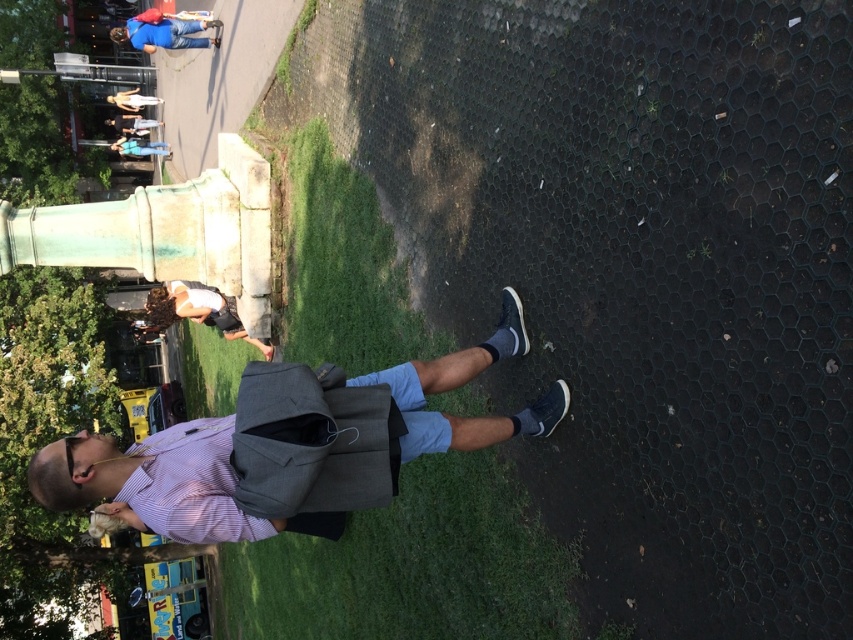
Question: Which point appears closest to the camera in this image?

Choices:
 (A) (128, 144)
 (B) (119, 92)
 (C) (138, 118)
 (D) (329, 582)

Answer: (D)

Question: Can you confirm if matte gray backpack at center is positioned below light blue denim shorts at upper center?

Choices:
 (A) no
 (B) yes

Answer: (B)

Question: Among these objects, which one is nearest to the camera?

Choices:
 (A) green grass at center
 (B) white cotton tank top at center
 (C) matte gray backpack at center

Answer: (A)

Question: Which of the following is the closest to the observer?

Choices:
 (A) matte blue jeans at upper left
 (B) white cotton tank top at center
 (C) green grass at center
 (D) dark gray backpack at upper left

Answer: (C)

Question: Does matte gray backpack at center appear on the left side of light blue denim shorts at upper center?

Choices:
 (A) yes
 (B) no

Answer: (B)

Question: Is blue jeans at upper left wider than light blue denim shorts at upper center?

Choices:
 (A) yes
 (B) no

Answer: (B)